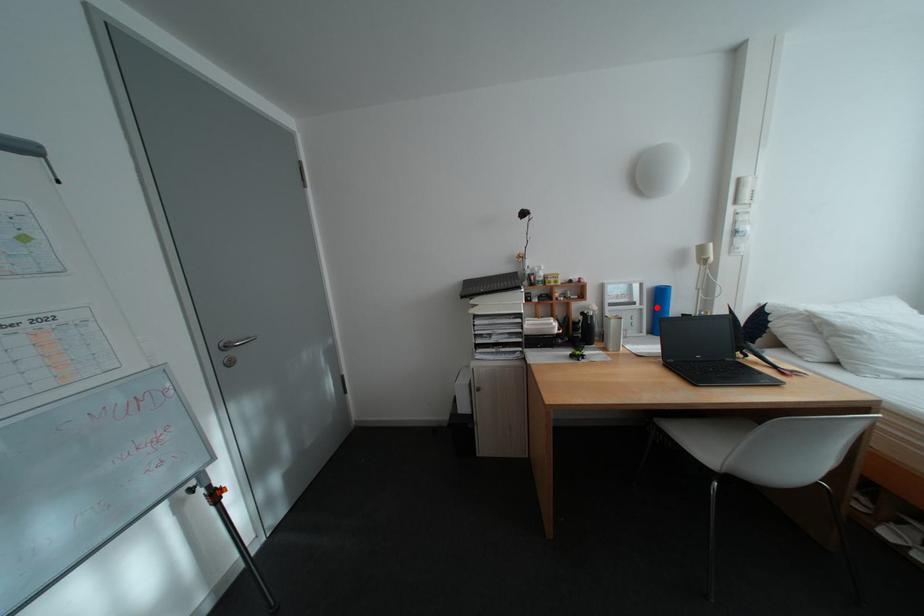
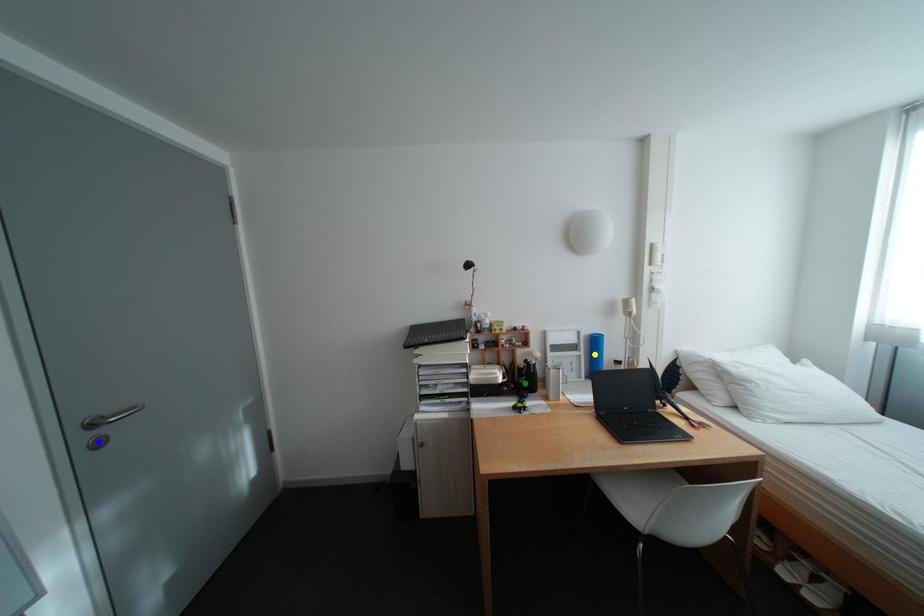
Question: I am providing you with two images of the same scene from different viewpoints. A red point is marked on the first image. You are given multiple points on the second image. Which point in image 2 is actually the same real-world point as the red point in image 1?

Choices:
 (A) green point
 (B) blue point
 (C) yellow point

Answer: (C)